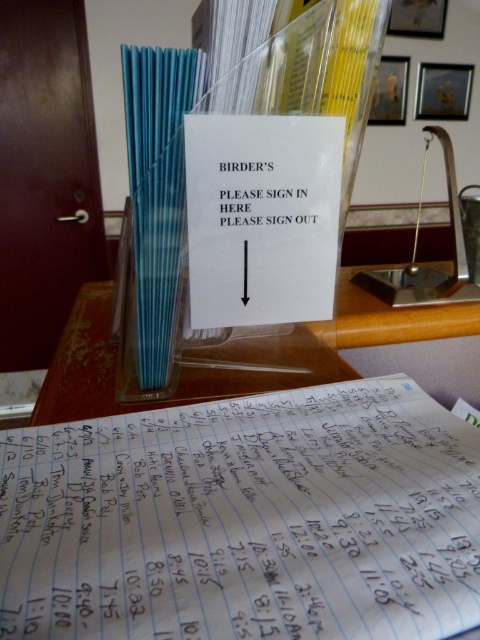
Question: Which object is farther from the camera taking this photo?

Choices:
 (A) white paper sign at center
 (B) blue lined paper at center

Answer: (A)

Question: Is blue lined paper at center wider than white paper at center?

Choices:
 (A) no
 (B) yes

Answer: (B)

Question: Among these points, which one is nearest to the camera?

Choices:
 (A) (279, 180)
 (B) (271, 410)

Answer: (B)

Question: Which point is closer to the camera taking this photo?

Choices:
 (A) (243, 244)
 (B) (135, 605)

Answer: (B)

Question: Is the position of blue lined paper at center more distant than that of white paper sign at center?

Choices:
 (A) no
 (B) yes

Answer: (A)

Question: Does blue lined paper at center have a smaller size compared to white paper at center?

Choices:
 (A) no
 (B) yes

Answer: (A)